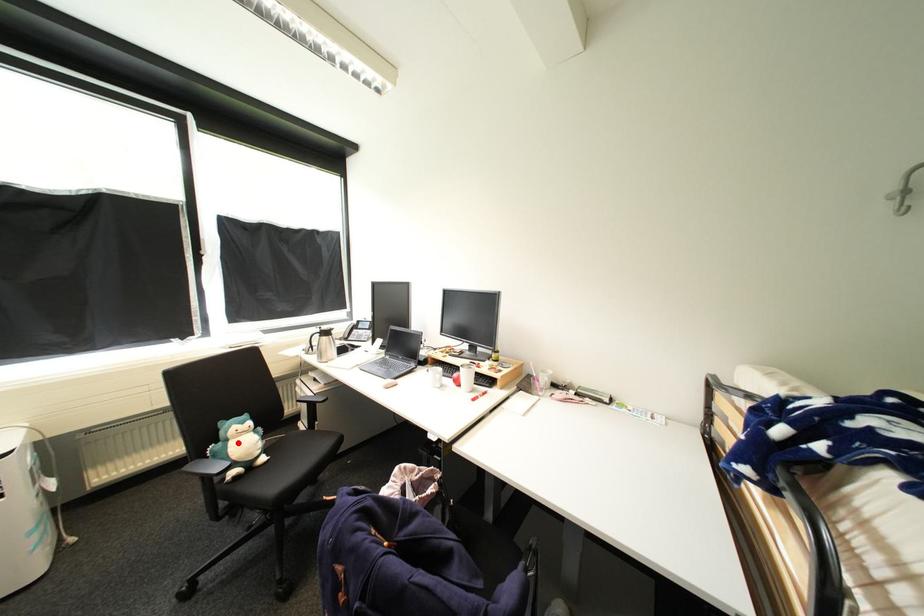
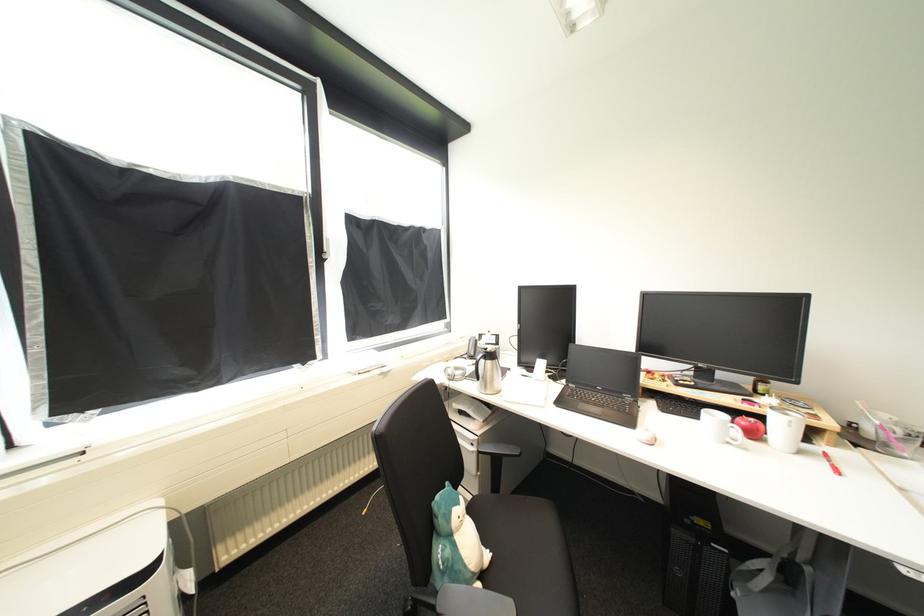
In the second image, find the point that corresponds to the highlighted location in the first image.

(464, 538)